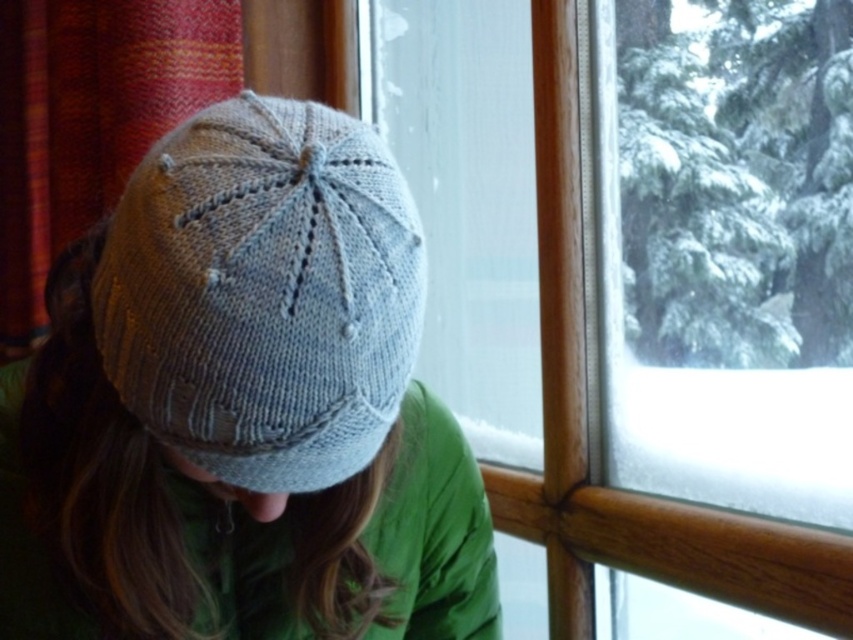
You are standing in the room and want to touch both the transparent glass window at center and the knitted woolen hat at center. Which object will you reach first?

You will reach the transparent glass window at center first because it is closer to you than the knitted woolen hat at center.

You are trying to decide which hat to wear based on the image. The knitted woolen hat at center and the knitted gray hat at center are both options. Which hat has a wider width?

The knitted woolen hat at center has a larger width than the knitted gray hat at center according to the description.

You are trying to see the outdoor winter scene through the transparent glass window at center. However, the knitted gray hat at center is blocking your view. Can you move the hat to the side to get a better view?

The transparent glass window at center is larger than the knitted gray hat at center, so you can move the knitted gray hat at center to the side to get a better view through the transparent glass window at center.